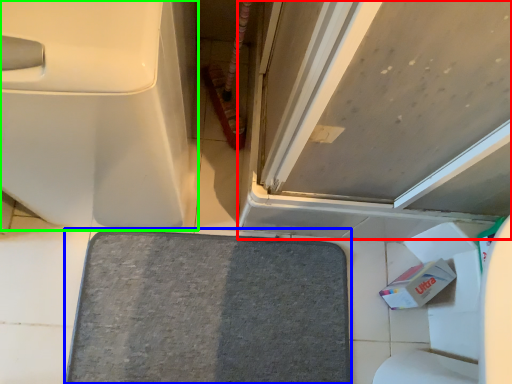
Question: Considering the real-world distances, which object is closest to door (highlighted by a red box)? bath mat (highlighted by a blue box) or toilet (highlighted by a green box).

Choices:
 (A) bath mat
 (B) toilet

Answer: (B)